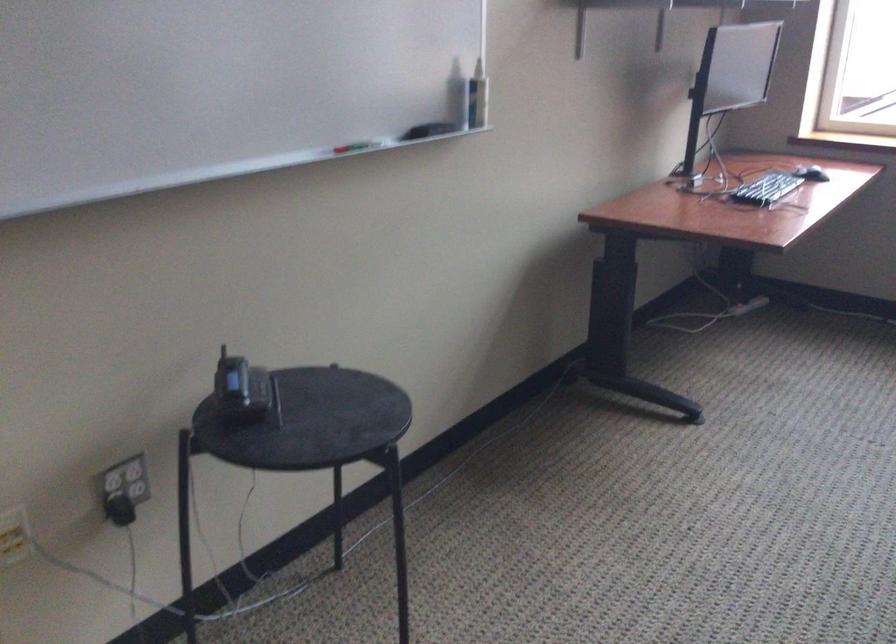
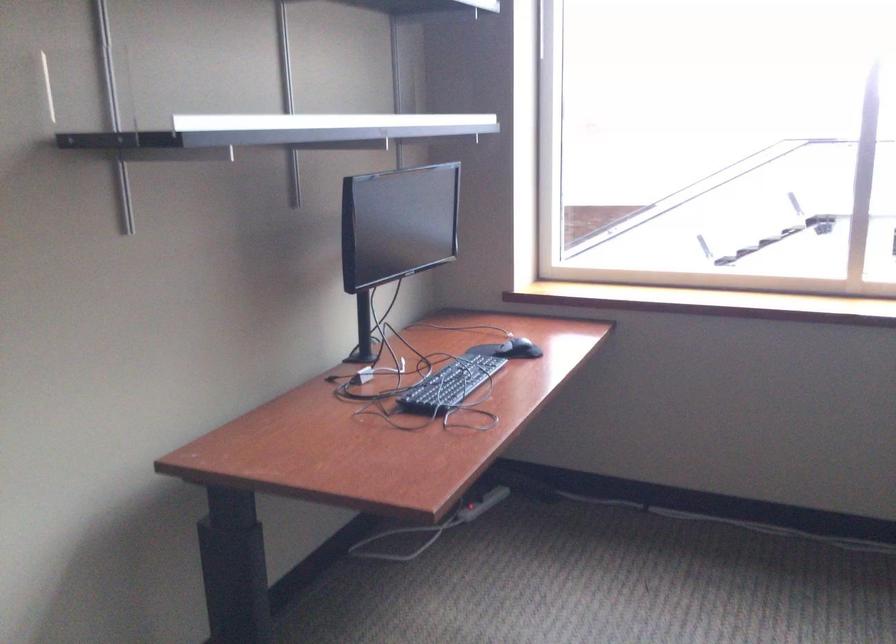
In a continuous first-person perspective shot, in which direction is the camera moving?

The cameraman moved toward right, forward.